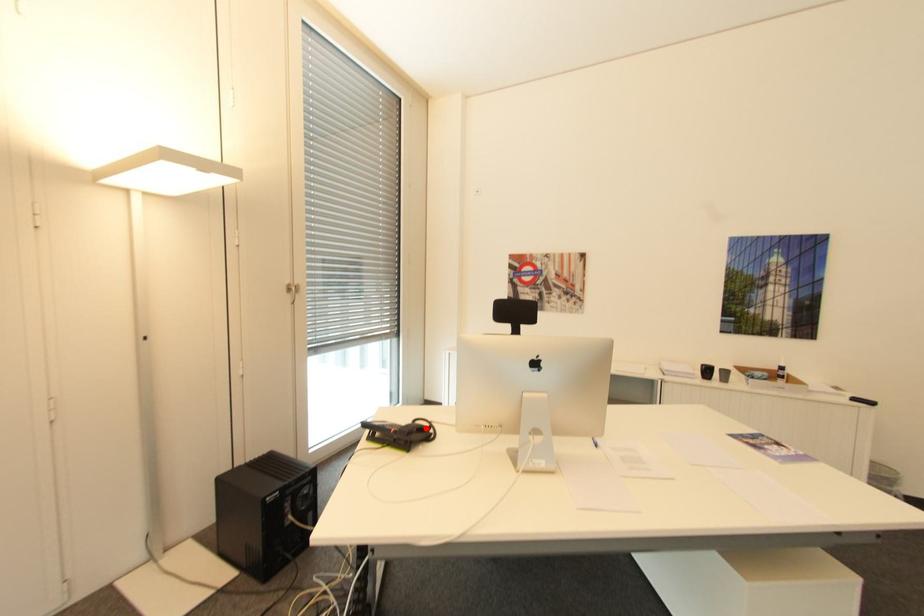
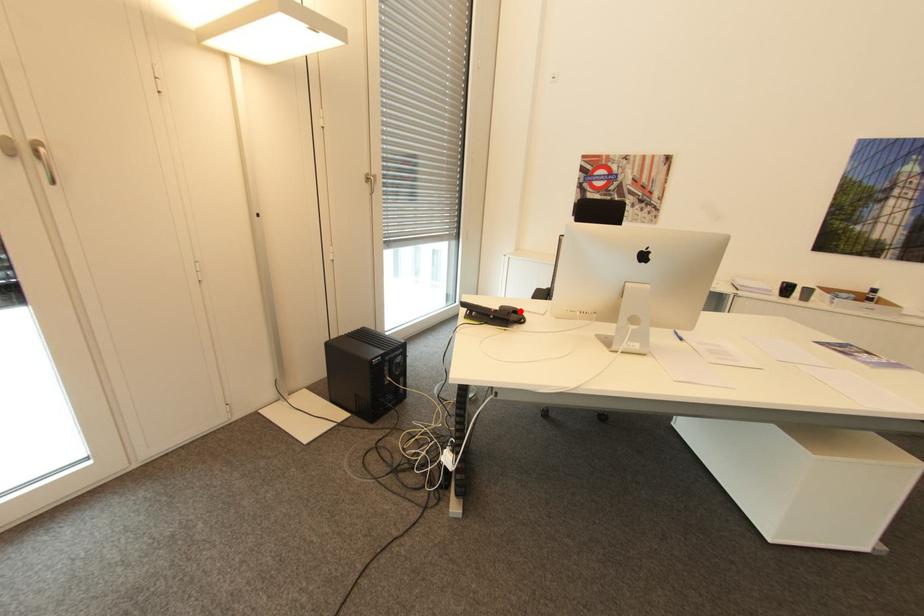
I am providing you with two images of the same scene from different viewpoints. A red point is marked on the first image and another point is marked on the second image. Are the points marked in image1 and image2 representing the same 3D position?

Yes